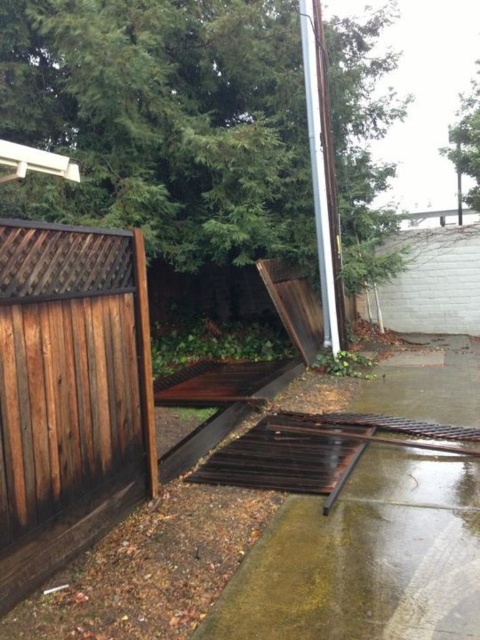
Question: Which point appears closest to the camera in this image?

Choices:
 (A) (321, 80)
 (B) (3, 563)

Answer: (B)

Question: Does brown wooden fence at left have a smaller size compared to silver metallic pole at upper right?

Choices:
 (A) no
 (B) yes

Answer: (B)

Question: Which of the following is the closest to the observer?

Choices:
 (A) (336, 339)
 (B) (52, 328)

Answer: (B)

Question: Which point is closer to the camera?

Choices:
 (A) silver metallic pole at upper right
 (B) brown wooden fence at left

Answer: (B)

Question: Does brown wooden fence at left have a smaller size compared to silver metallic pole at upper right?

Choices:
 (A) yes
 (B) no

Answer: (A)

Question: Observing the image, what is the correct spatial positioning of brown wooden fence at left in reference to silver metallic pole at upper right?

Choices:
 (A) above
 (B) below

Answer: (B)